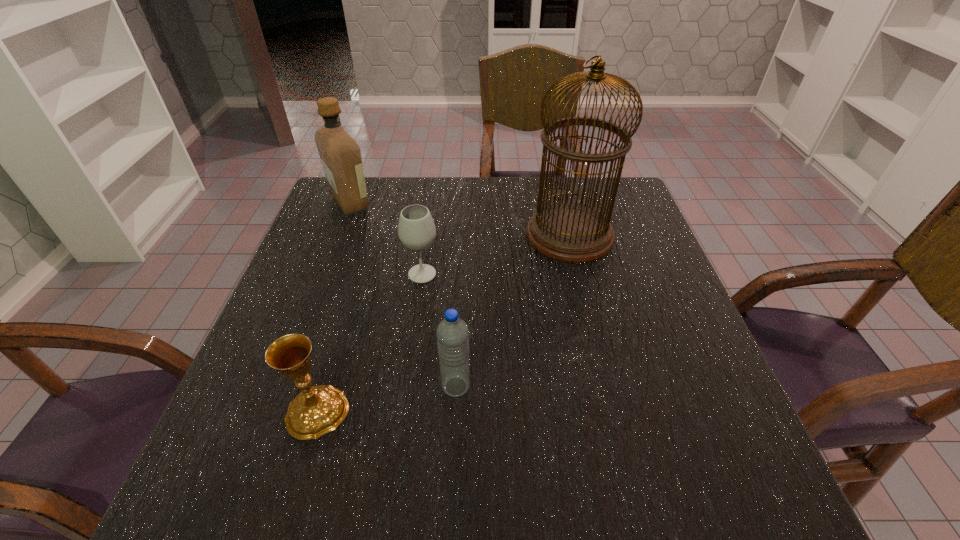
The image size is (960, 540). I want to click on vacant space situated on the left of the water bottle, so click(255, 386).

Identify the location of vacant space located 0.350m on the right of the wineglass. (586, 274).

You are a GUI agent. You are given a task and a screenshot of the screen. Output one action in this format:
    pyautogui.click(x=<x>, y=<y>)
    Task: Click on the vacant space located on the front of the chalice
    
    Given the screenshot: What is the action you would take?
    pyautogui.click(x=291, y=502)

Find the location of a particular element. The image size is (960, 540). birdcage present at the far edge is located at coordinates (572, 232).

This screenshot has height=540, width=960. Find the location of `liquor that is at the far edge`. liquor that is at the far edge is located at coordinates (340, 154).

I want to click on liquor present at the left edge, so click(x=340, y=154).

The image size is (960, 540). In order to click on chalice present at the left edge in this screenshot , I will do `click(316, 410)`.

You are a GUI agent. You are given a task and a screenshot of the screen. Output one action in this format:
    pyautogui.click(x=<x>, y=<y>)
    Task: Click on the object at the right edge
    The image size is (960, 540).
    Given the screenshot: What is the action you would take?
    pyautogui.click(x=572, y=232)

This screenshot has width=960, height=540. Identify the location of object located at the far left corner. (340, 154).

Identify the location of object at the far right corner. Image resolution: width=960 pixels, height=540 pixels. (572, 232).